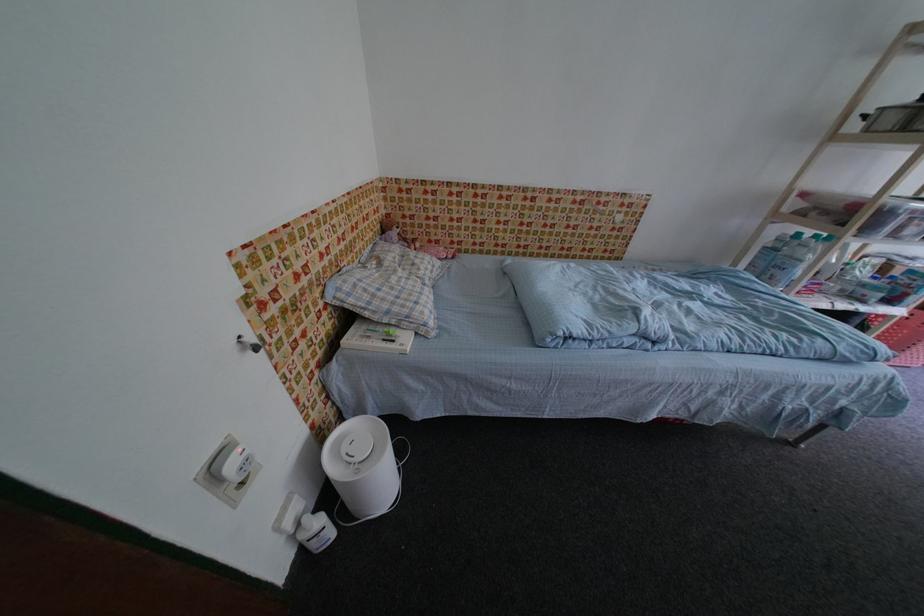
Where would you lift the small white bottle? Please return your answer as a coordinate pair (x, y).

(314, 532)